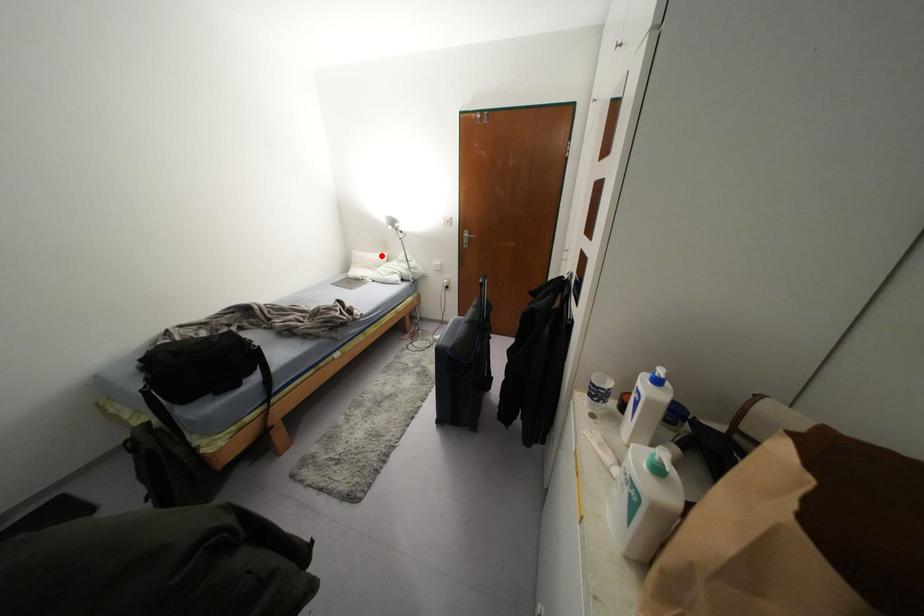
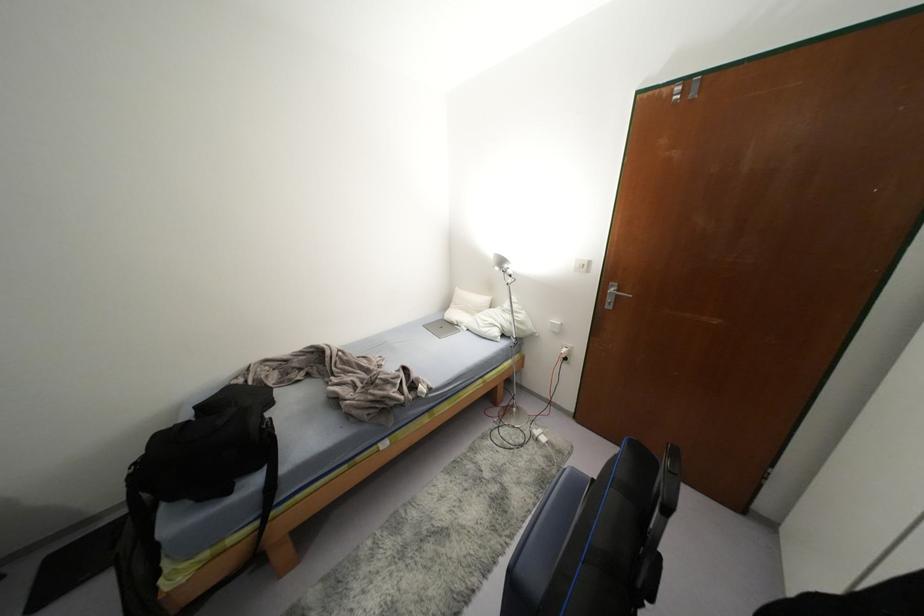
Locate, in the second image, the point that corresponds to the highlighted location in the first image.

(484, 299)